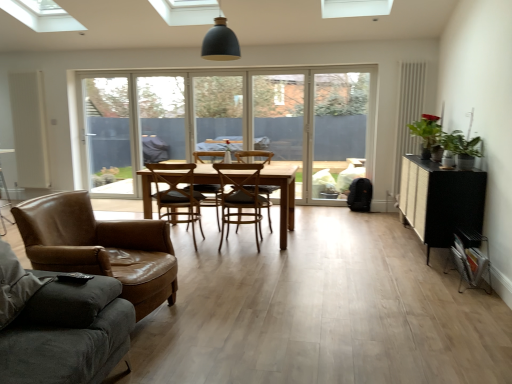
The height and width of the screenshot is (384, 512). What do you see at coordinates (59, 325) in the screenshot?
I see `dark gray fabric studio couch at lower left` at bounding box center [59, 325].

The image size is (512, 384). What do you see at coordinates (177, 194) in the screenshot? I see `brown leather chair at center, arranged as the 3th chair when viewed from the front` at bounding box center [177, 194].

I want to click on transparent glass window at center, so click(x=218, y=112).

What do you see at coordinates (210, 197) in the screenshot? I see `wooden chair at center, the 4th chair viewed from the front` at bounding box center [210, 197].

In order to click on black textured cabinet at right in this screenshot , I will do `click(440, 200)`.

The image size is (512, 384). What are the coordinates of `white matte screen door at left, which appears as the first screen door when viewed from the left` in the screenshot? It's located at (29, 129).

You are a GUI agent. You are given a task and a screenshot of the screen. Output one action in this format:
    pyautogui.click(x=<x>, y=<y>)
    Task: Click on the dark gray fabric studio couch at lower left
    This screenshot has height=384, width=512.
    Given the screenshot: What is the action you would take?
    pyautogui.click(x=59, y=325)

Is transparent glass door at center facing towards dark gray fabric studio couch at lower left?

Yes, transparent glass door at center is oriented towards dark gray fabric studio couch at lower left.

Which object is closer to the camera taking this photo, transparent glass door at center or dark gray fabric studio couch at lower left?

dark gray fabric studio couch at lower left is in front.

Can you confirm if transparent glass door at center is bigger than dark gray fabric studio couch at lower left?

Actually, transparent glass door at center might be smaller than dark gray fabric studio couch at lower left.

From their relative heights in the image, would you say transparent glass door at center is taller or shorter than brown leather chair at center, placed as the second chair when sorted from back to front?

Considering their sizes, transparent glass door at center has more height than brown leather chair at center, placed as the second chair when sorted from back to front.

Would you say transparent glass door at center is inside or outside brown leather chair at center, arranged as the 3th chair when viewed from the front?

transparent glass door at center is located beyond the bounds of brown leather chair at center, arranged as the 3th chair when viewed from the front.

From a real-world perspective, is transparent glass door at center positioned above or below brown leather chair at center, placed as the second chair when sorted from back to front?

Clearly, from a real-world perspective, transparent glass door at center is above brown leather chair at center, placed as the second chair when sorted from back to front.

In the scene shown: Measure the distance from transparent glass door at center to brown leather chair at center, arranged as the 3th chair when viewed from the front.

transparent glass door at center is 2.67 meters away from brown leather chair at center, arranged as the 3th chair when viewed from the front.

Is green glossy plant at right aimed at brown leather armchair at left, the first chair positioned from the front?

No.

Is green glossy plant at right smaller than brown leather armchair at left, the first chair positioned from the front?

Yes.

Which object is positioned more to the right, green glossy plant at right or brown leather armchair at left, the first chair positioned from the front?

From the viewer's perspective, green glossy plant at right appears more on the right side.

From the picture: From a real-world perspective, who is located higher, green glossy plant at right or brown leather armchair at left, which is the fourth chair in back-to-front order?

green glossy plant at right, from a real-world perspective.

Is the depth of dark gray fabric studio couch at lower left less than that of matte black pendant lamp at upper center?

Yes, the depth of dark gray fabric studio couch at lower left is less than that of matte black pendant lamp at upper center.

Could matte black pendant lamp at upper center be considered to be inside dark gray fabric studio couch at lower left?

No.

From a real-world perspective, is dark gray fabric studio couch at lower left under matte black pendant lamp at upper center?

Yes.

At what (x,y) coordinates should I click in order to perform the action: click on studio couch that is on the left side of matte black pendant lamp at upper center. Please return your answer as a coordinate pair (x, y). This screenshot has height=384, width=512. Looking at the image, I should click on (59, 325).

In the image, there is a brown leather chair at center, arranged as the 3th chair when viewed from the front. Find the location of `chair below it (from the image's perspective)`. chair below it (from the image's perspective) is located at coordinates (100, 247).

Does brown leather chair at center, arranged as the 3th chair when viewed from the front, have a larger size compared to brown leather armchair at left, which is the fourth chair in back-to-front order?

No.

Is brown leather chair at center, placed as the second chair when sorted from back to front, beside brown leather armchair at left, which is the fourth chair in back-to-front order?

No.

From a real-world perspective, is brown leather chair at center, arranged as the 3th chair when viewed from the front, positioned under brown leather armchair at left, the first chair positioned from the front, based on gravity?

Actually, brown leather chair at center, arranged as the 3th chair when viewed from the front, is physically above brown leather armchair at left, the first chair positioned from the front, in the real world.

From the image's perspective, which one is positioned higher, dark gray fabric studio couch at lower left or light brown wooden table at center?

light brown wooden table at center appears higher in the image.

From a real-world perspective, is dark gray fabric studio couch at lower left positioned above or below light brown wooden table at center?

dark gray fabric studio couch at lower left is above light brown wooden table at center.

Does point (4, 266) lie behind point (147, 187)?

No, it is in front of (147, 187).

The width and height of the screenshot is (512, 384). Identify the location of kitchen & dining room table lying above the dark gray fabric studio couch at lower left (from the image's perspective). pyautogui.click(x=283, y=195).

Considering the relative positions of transparent glass door at left and transparent glass door at center in the image provided, is transparent glass door at left behind transparent glass door at center?

Yes.

Does transparent glass door at left have a lesser width compared to transparent glass door at center?

In fact, transparent glass door at left might be wider than transparent glass door at center.

Looking at the image, does transparent glass door at left seem bigger or smaller compared to transparent glass door at center?

In the image, transparent glass door at left appears to be smaller than transparent glass door at center.

From the image's perspective, does transparent glass door at left appear lower than transparent glass door at center?

No.

This screenshot has height=384, width=512. What are the coordinates of `glass door above the dark gray fabric studio couch at lower left (from the image's perspective)` in the screenshot? It's located at (315, 126).

From the transparent glass door at center, count 2nd chairs forward and point to it. Please provide its 2D coordinates.

[(177, 194)]

Which object lies nearer to the anchor point white matte screen door at left, the second screen door in the right-to-left sequence, transparent glass window at center or brown leather chair at center, arranged as the 3th chair when viewed from the front?

The object closer to white matte screen door at left, the second screen door in the right-to-left sequence, is transparent glass window at center.

Estimate the real-world distances between objects in this image. Which object is further from green glossy plant at right, white matte screen door at left, the second screen door in the right-to-left sequence, or transparent glass window at center?

white matte screen door at left, the second screen door in the right-to-left sequence, is further to green glossy plant at right.

Estimate the real-world distances between objects in this image. Which object is closer to brown leather armchair at left, which is the fourth chair in back-to-front order, light brown wooden table at center or brown leather chair at center, placed as the second chair when sorted from back to front?

Based on the image, brown leather chair at center, placed as the second chair when sorted from back to front, appears to be nearer to brown leather armchair at left, which is the fourth chair in back-to-front order.

Based on their spatial positions, is transparent glass door at left or matte black pendant lamp at upper center further from transparent plastic screen door at center, which ranks as the first screen door in right-to-left order?

matte black pendant lamp at upper center is further to transparent plastic screen door at center, which ranks as the first screen door in right-to-left order.

When comparing their distances from green glossy plant at right, does white matte screen door at left, the second screen door in the right-to-left sequence, or transparent glass door at left seem closer?

The object closer to green glossy plant at right is transparent glass door at left.

When comparing their distances from transparent glass window at center, does brown leather armchair at left, which is the fourth chair in back-to-front order, or wooden chair at center, the 1th chair viewed from the back, seem further?

Among the two, brown leather armchair at left, which is the fourth chair in back-to-front order, is located further to transparent glass window at center.

Looking at the image, which one is located closer to brown leather armchair at center, transparent glass window at center or wooden chair at center, the 1th chair viewed from the back?

wooden chair at center, the 1th chair viewed from the back, lies closer to brown leather armchair at center than the other object.

Considering their positions, is transparent glass window at center positioned closer to brown leather armchair at left, which is the fourth chair in back-to-front order, than brown leather chair at center, arranged as the 3th chair when viewed from the front?

brown leather chair at center, arranged as the 3th chair when viewed from the front.

At what (x,y) coordinates should I click in order to perform the action: click on light fixture between white matte screen door at left, the second screen door in the right-to-left sequence, and wooden chair at center, arranged as the 3th chair when viewed from the back, from left to right. Please return your answer as a coordinate pair (x, y). This screenshot has height=384, width=512. Looking at the image, I should click on (220, 41).

Identify the location of light fixture between transparent glass window at center and green glossy plant at right in the horizontal direction. This screenshot has height=384, width=512. click(x=220, y=41).

At what (x,y) coordinates should I click in order to perform the action: click on kitchen & dining room table located between wooden chair at center, arranged as the 3th chair when viewed from the back, and wooden chair at center, the 1th chair viewed from the back, in the depth direction. Please return your answer as a coordinate pair (x, y). Looking at the image, I should click on (283, 195).

Locate an element on the screen. window screen between white matte screen door at left, which appears as the first screen door when viewed from the left, and matte black pendant lamp at upper center from left to right is located at coordinates (110, 134).